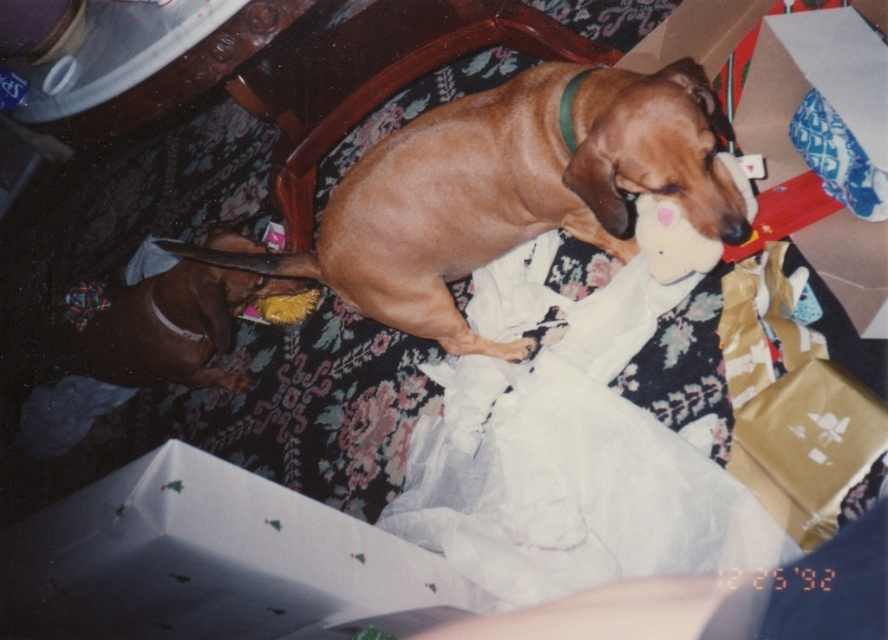
Question: Can you confirm if brown smooth dog at center is positioned below white plush toy at upper center?

Choices:
 (A) yes
 (B) no

Answer: (B)

Question: Which point appears closest to the camera in this image?

Choices:
 (A) (764, 86)
 (B) (541, 228)
 (C) (74, 346)

Answer: (A)

Question: Can you confirm if brown smooth dog at center is wider than gold cardboard box at upper right?

Choices:
 (A) no
 (B) yes

Answer: (B)

Question: Based on their relative distances, which object is nearer to the gold cardboard box at upper right?

Choices:
 (A) brown smooth dog at center
 (B) brown matte dog at lower left
 (C) white plush toy at upper center

Answer: (C)

Question: Is brown smooth dog at center to the left of brown matte dog at lower left from the viewer's perspective?

Choices:
 (A) no
 (B) yes

Answer: (A)

Question: Estimate the real-world distances between objects in this image. Which object is farther from the gold cardboard box at upper right?

Choices:
 (A) brown matte dog at lower left
 (B) white plush toy at upper center

Answer: (A)